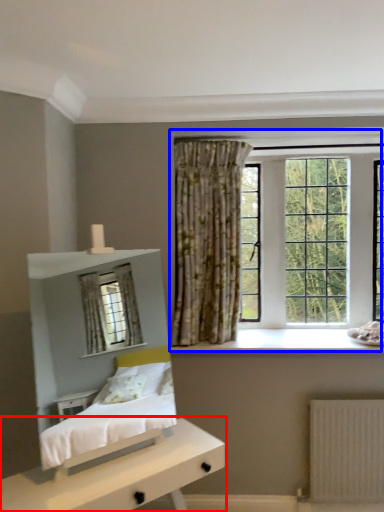
Question: Which of the following is the closest to the observer, nightstand (highlighted by a red box) or window (highlighted by a blue box)?

Choices:
 (A) nightstand
 (B) window

Answer: (A)